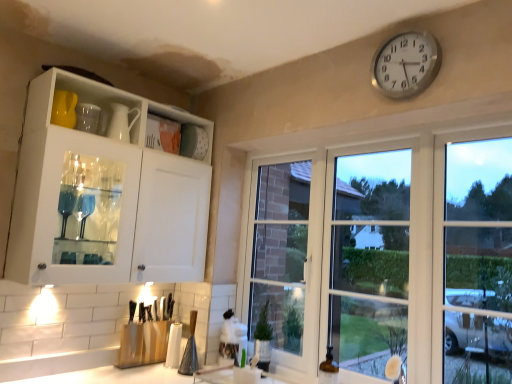
Question: Is point (270, 284) positioned closer to the camera than point (176, 279)?

Choices:
 (A) farther
 (B) closer

Answer: (A)

Question: From their relative heights in the image, would you say clear glass windows at center is taller or shorter than white glossy cabinet at upper left?

Choices:
 (A) short
 (B) tall

Answer: (B)

Question: Which object is positioned farthest from the silver metallic clock at upper right?

Choices:
 (A) clear glass windows at center
 (B) white glossy cabinet at upper left

Answer: (B)

Question: Which object is the closest to the white glossy cabinet at upper left?

Choices:
 (A) clear glass windows at center
 (B) silver metallic clock at upper right

Answer: (A)